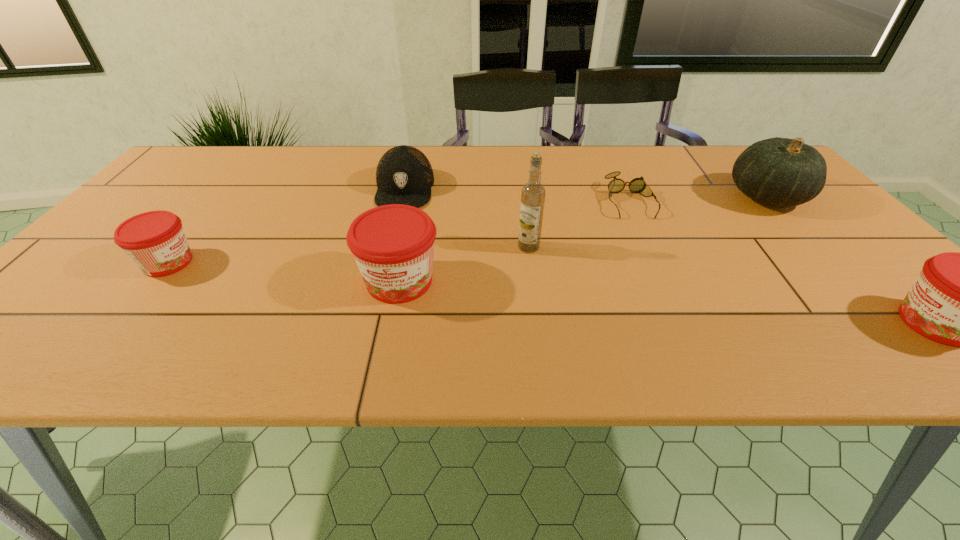
Find the location of a particular element. This screenshot has height=540, width=960. free spot located 0.120m on the left of the gourd is located at coordinates (683, 197).

Image resolution: width=960 pixels, height=540 pixels. What are the coordinates of `free space located 0.150m on the front-facing side of the cap` in the screenshot? It's located at (390, 249).

Find the location of a particular element. The width and height of the screenshot is (960, 540). free space located 0.210m on the front-facing side of the shortest object is located at coordinates (663, 275).

Find the location of a particular element. Image resolution: width=960 pixels, height=540 pixels. vacant region located 0.310m on the label of the vodka is located at coordinates pyautogui.click(x=385, y=247).

Find the location of a particular element. The width and height of the screenshot is (960, 540). free location located 0.110m on the label of the vodka is located at coordinates tap(470, 247).

This screenshot has height=540, width=960. I want to click on vacant region located 0.260m on the label of the vodka, so click(406, 247).

Where is `gourd that is at the far edge`? gourd that is at the far edge is located at coordinates (782, 172).

Find the location of a particular element. cap at the far edge is located at coordinates (x=404, y=175).

Locate an element on the screen. The width and height of the screenshot is (960, 540). spectacles present at the far edge is located at coordinates (637, 185).

Locate an element on the screen. This screenshot has width=960, height=540. object situated at the near edge is located at coordinates (393, 245).